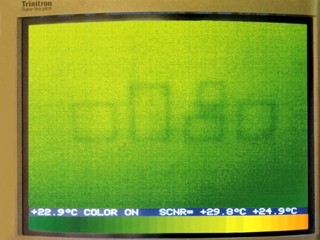
Find the location of a particular element. The height and width of the screenshot is (240, 320). top monitor frame is located at coordinates (176, 7).